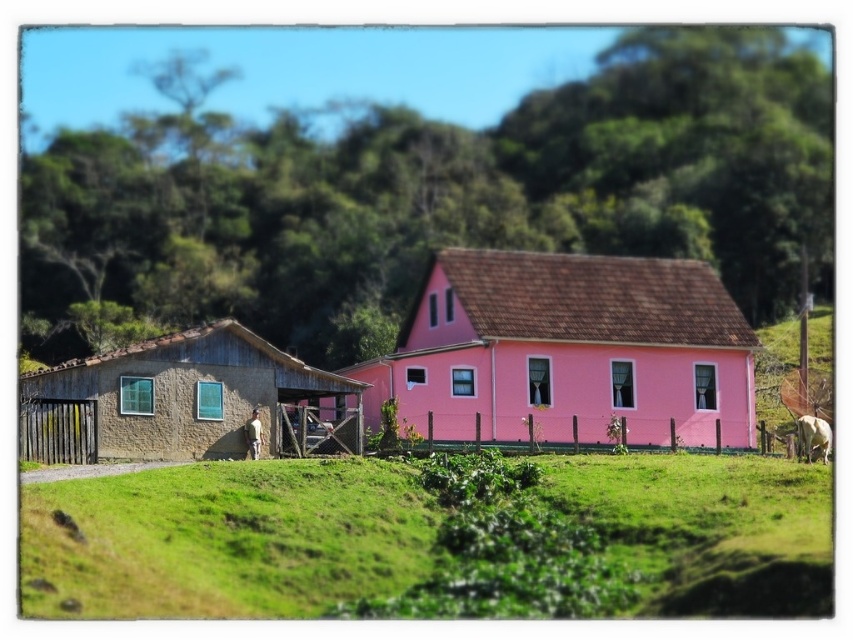
From the picture: You are standing at the point labeled as point (x=567, y=349). Which object are you currently at?

You are at the pink matte house at center, as the point (x=567, y=349) represents its location.

You are planning to set up a picnic area in the rural scene. The green grassy field at lower center and the stucco hut at left are both potential locations. Based on the size of these areas, which location would be more suitable for accommodating a larger group of people?

The green grassy field at lower center is more suitable for accommodating a larger group of people since it has a larger size compared to the stucco hut at left.

Looking at this image, you are standing at the edge of the green grassy field at lower center and want to walk to the pink matte house at center. Which direction should you head towards?

The green grassy field at lower center is to the left of the pink matte house at center, so you should head towards the right to reach the pink matte house at center.